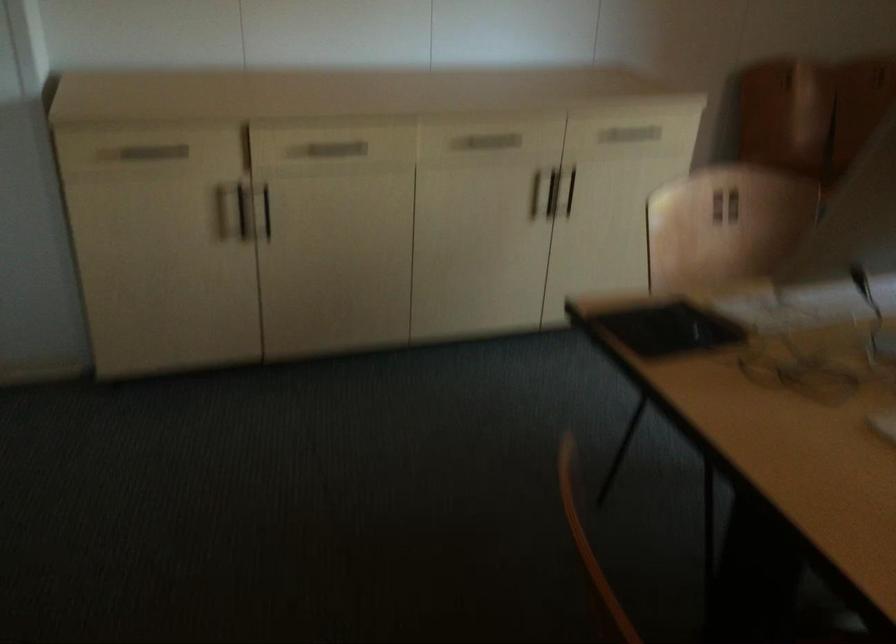
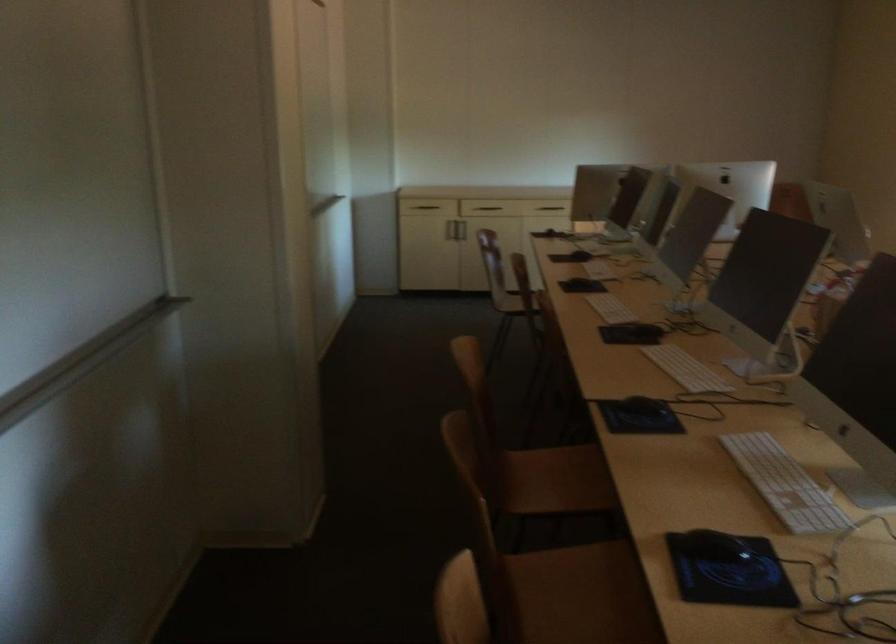
Question: I am providing you with two images of the same scene from different viewpoints. Please identify which objects are invisible in image2.

Choices:
 (A) metal cabinet handle
 (B) wooden chair sitting surface
 (C) vertical cabinet handle
 (D) orange jar lid

Answer: (C)